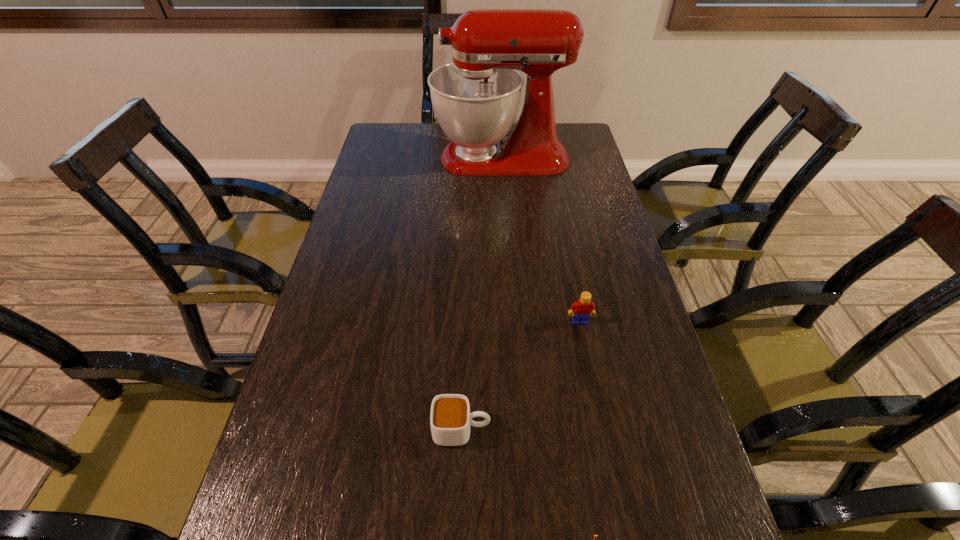
Where is `the tallest object`? The width and height of the screenshot is (960, 540). the tallest object is located at coordinates tap(476, 98).

The height and width of the screenshot is (540, 960). I want to click on mixer, so click(476, 98).

You are a GUI agent. You are given a task and a screenshot of the screen. Output one action in this format:
    pyautogui.click(x=<x>, y=<y>)
    Task: Click on the third nearest object
    The height and width of the screenshot is (540, 960).
    Given the screenshot: What is the action you would take?
    click(x=583, y=308)

Where is `the second tallest object`? This screenshot has height=540, width=960. the second tallest object is located at coordinates (583, 308).

The width and height of the screenshot is (960, 540). What are the coordinates of `the third tallest object` in the screenshot? It's located at (450, 419).

Image resolution: width=960 pixels, height=540 pixels. Identify the location of the second nearest object. (450, 419).

Locate an element on the screen. The image size is (960, 540). free space located 0.240m at the attachment hub of the mixer is located at coordinates (367, 158).

This screenshot has width=960, height=540. In order to click on free space located 0.110m at the attachment hub of the mixer in this screenshot , I will do `click(403, 158)`.

At what (x,y) coordinates should I click in order to perform the action: click on vacant space situated 0.120m at the attachment hub of the mixer. Please return your answer as a coordinate pair (x, y). The width and height of the screenshot is (960, 540). Looking at the image, I should click on (400, 158).

Identify the location of free space located 0.300m on the face of the Lego. (605, 450).